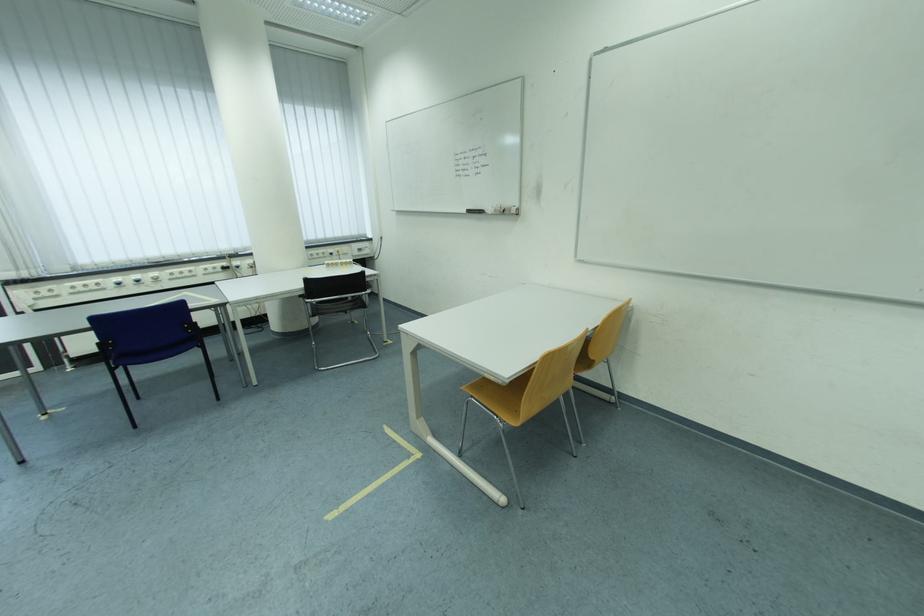
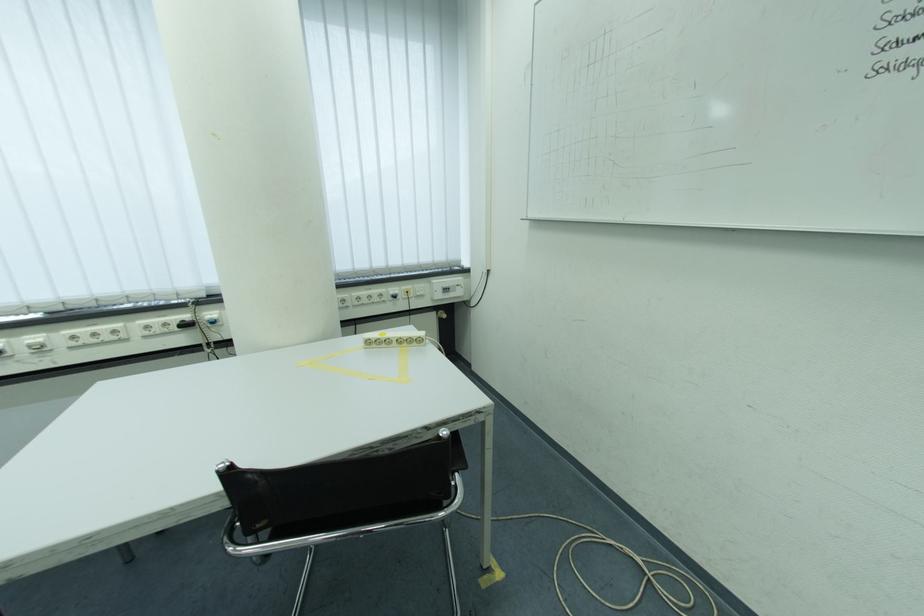
The point at (224, 270) is marked in the first image. Where is the corresponding point in the second image?

(175, 326)